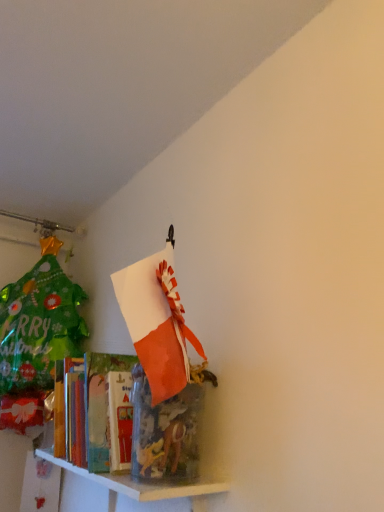
Question: In terms of size, does translucent plastic container at lower left, which is the 2th shelf in bottom-to-top order, appear bigger or smaller than white glossy shelf at lower left, arranged as the 1th shelf when ordered from the bottom?

Choices:
 (A) big
 (B) small

Answer: (A)

Question: Considering the positions of translucent plastic container at lower left, arranged as the first shelf when viewed from the top, and white glossy shelf at lower left, arranged as the 2th shelf when viewed from the top, in the image, is translucent plastic container at lower left, arranged as the first shelf when viewed from the top, wider or thinner than white glossy shelf at lower left, arranged as the 2th shelf when viewed from the top,?

Choices:
 (A) thin
 (B) wide

Answer: (B)

Question: Would you say translucent plastic container at lower left, which is the 2th shelf in bottom-to-top order, is to the left or to the right of white glossy shelf at lower left, arranged as the 1th shelf when ordered from the bottom, in the picture?

Choices:
 (A) left
 (B) right

Answer: (A)

Question: Considering the positions of white glossy shelf at lower left, arranged as the 2th shelf when viewed from the top, and translucent plastic container at lower left, which is the 2th shelf in bottom-to-top order, in the image, is white glossy shelf at lower left, arranged as the 2th shelf when viewed from the top, bigger or smaller than translucent plastic container at lower left, which is the 2th shelf in bottom-to-top order,?

Choices:
 (A) small
 (B) big

Answer: (A)

Question: From the image's perspective, relative to translucent plastic container at lower left, arranged as the first shelf when viewed from the top, is white glossy shelf at lower left, arranged as the 1th shelf when ordered from the bottom, above or below?

Choices:
 (A) above
 (B) below

Answer: (B)

Question: Is point (140, 496) positioned closer to the camera than point (99, 474)?

Choices:
 (A) closer
 (B) farther

Answer: (A)

Question: Would you say white glossy shelf at lower left, arranged as the 1th shelf when ordered from the bottom, is inside or outside translucent plastic container at lower left, arranged as the first shelf when viewed from the top?

Choices:
 (A) outside
 (B) inside

Answer: (A)